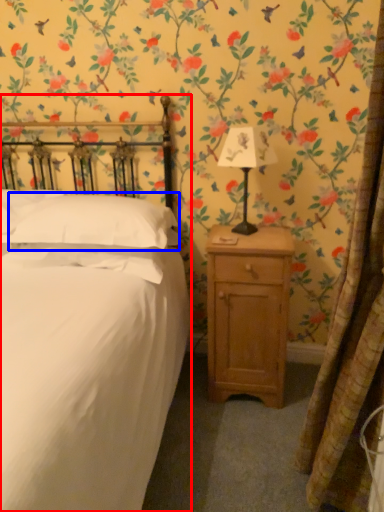
Question: Among these objects, which one is nearest to the camera, bed (highlighted by a red box) or pillow (highlighted by a blue box)?

Choices:
 (A) bed
 (B) pillow

Answer: (A)